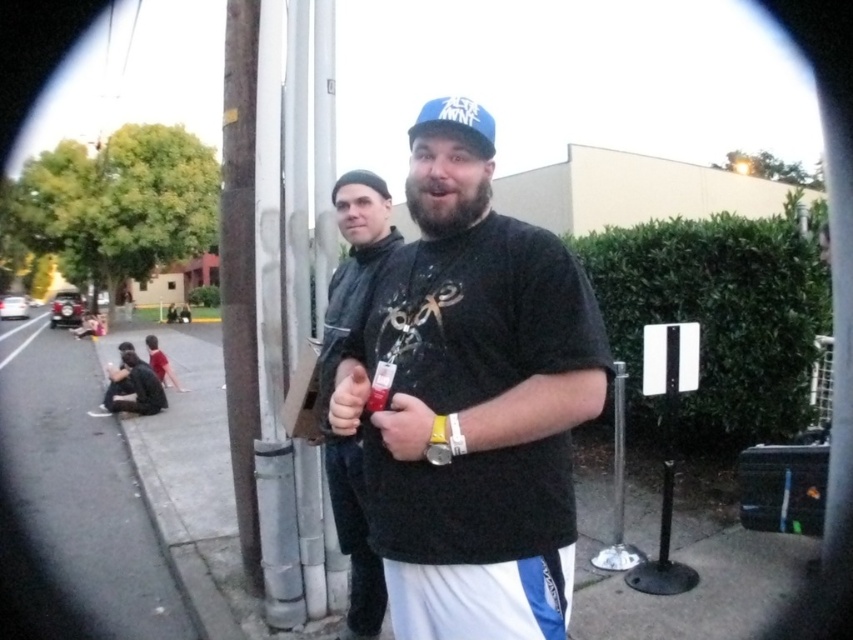
You are taking a photo with a fisheye lens and notice two points in the image labeled as point (47, 509) and point (373, 244). Based on their positions, which point is closer to the camera?

Point (47, 509) is further to the camera than point (373, 244).

You are standing at the edge of the image and want to walk towards the matte black jacket at center. Which direction should you move relative to the gray asphalt pavement at lower left?

The gray asphalt pavement at lower left is to the left of the matte black jacket at center, so to reach the matte black jacket at center, you should move to the right from the gray asphalt pavement at lower left.

You are standing in the scene and want to walk to the gray asphalt pavement at lower left. Is the matte black jacket at center blocking your path?

The matte black jacket at center is behind the gray asphalt pavement at lower left, so it is not blocking your path.